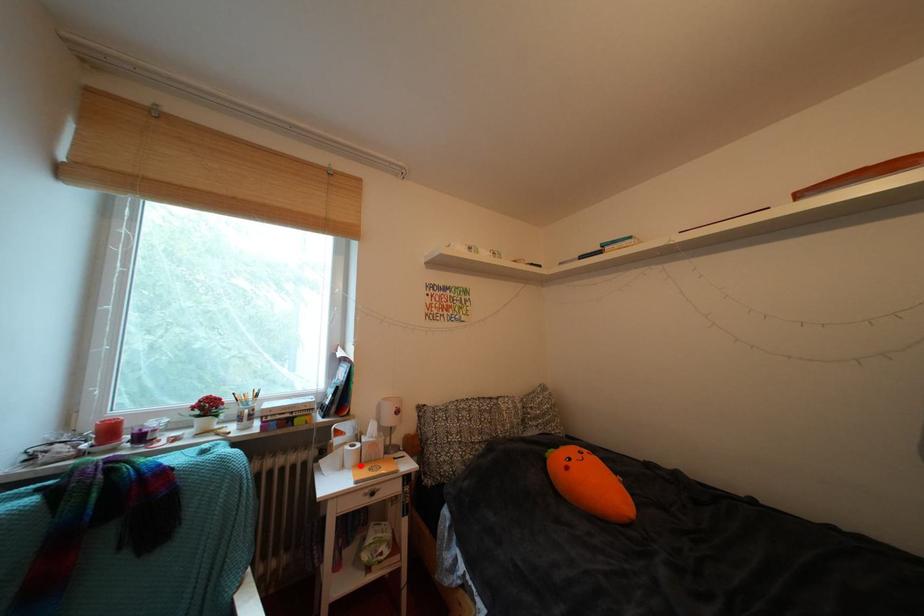
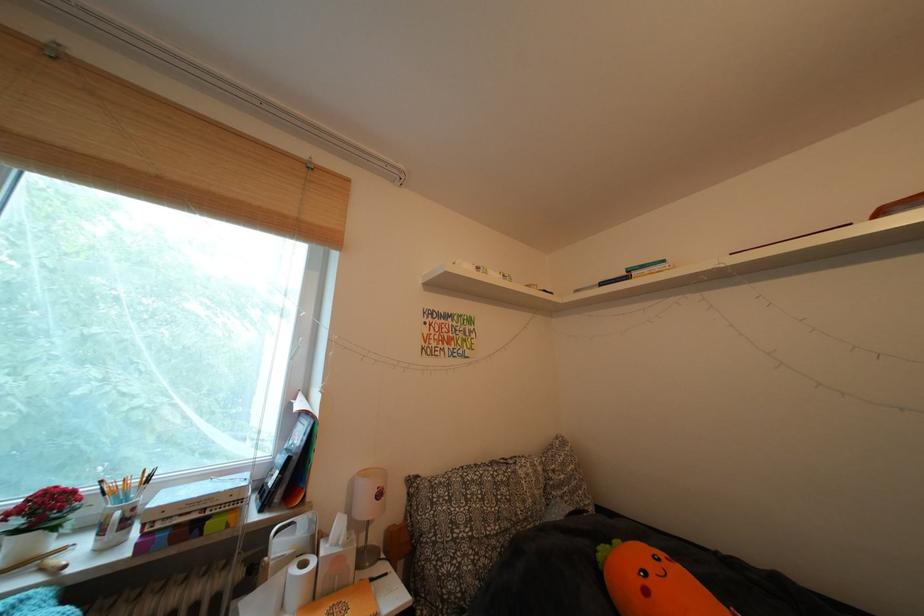
Question: I am providing you with two images of the same scene from different viewpoints. A red point is shown in image1. For the corresponding object point in image2, is it positioned nearer or farther from the camera?

Choices:
 (A) Nearer
 (B) Farther

Answer: (A)